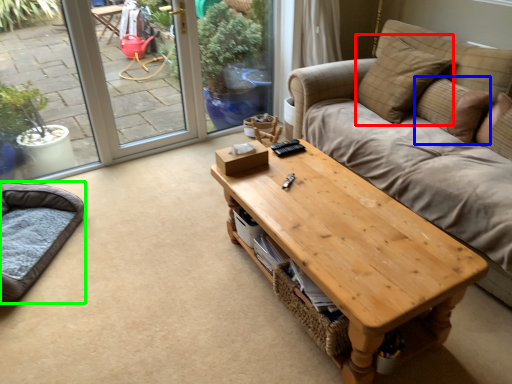
Question: Based on their relative distances, which object is nearer to pillow (highlighted by a red box)? Choose from pillow (highlighted by a blue box) and cat bed (highlighted by a green box).

Choices:
 (A) pillow
 (B) cat bed

Answer: (A)